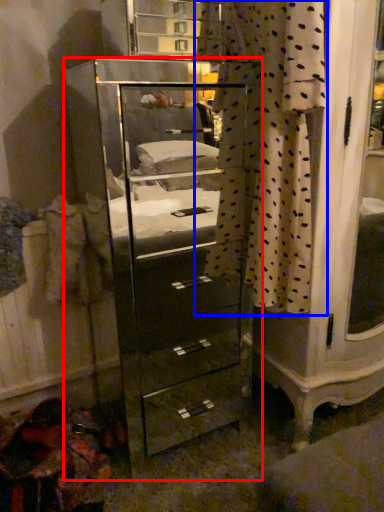
Question: Among these objects, which one is farthest to the camera, chest of drawers (highlighted by a red box) or curtain (highlighted by a blue box)?

Choices:
 (A) chest of drawers
 (B) curtain

Answer: (A)